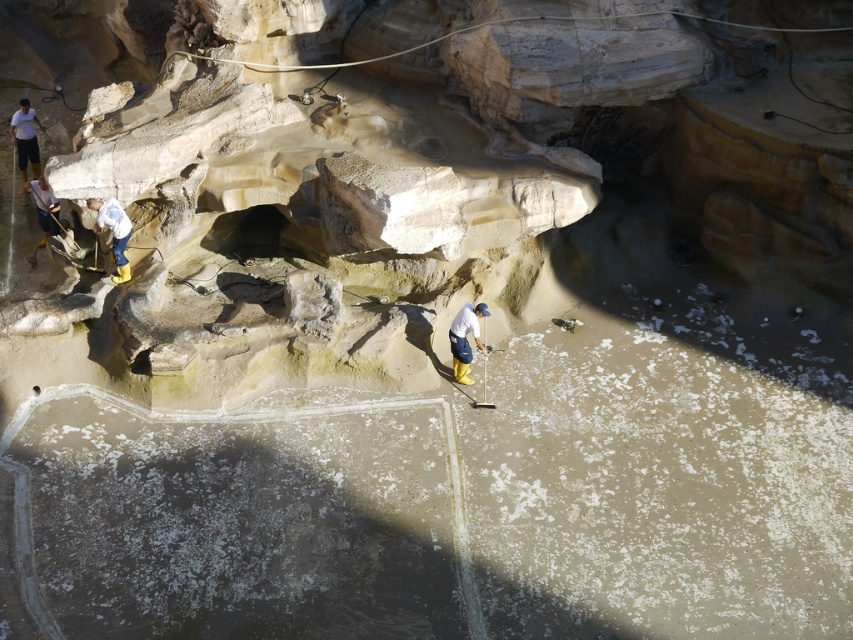
Question: Which point is closer to the camera taking this photo?

Choices:
 (A) [x=103, y=220]
 (B) [x=32, y=150]

Answer: (A)

Question: Estimate the real-world distances between objects in this image. Which object is farther from the white matte shirt at center?

Choices:
 (A) white matte shirt at upper left
 (B) white matte helmet at upper left
 (C) white fabric at left

Answer: (A)

Question: Can you confirm if white matte shirt at upper left is positioned below white matte helmet at upper left?

Choices:
 (A) no
 (B) yes

Answer: (A)

Question: Does white fabric at left have a greater width compared to white matte helmet at upper left?

Choices:
 (A) no
 (B) yes

Answer: (A)

Question: Which point appears closest to the camera in this image?

Choices:
 (A) (448, 333)
 (B) (32, 109)
 (C) (113, 236)

Answer: (A)

Question: Does white matte shirt at center have a smaller size compared to white matte helmet at upper left?

Choices:
 (A) yes
 (B) no

Answer: (A)